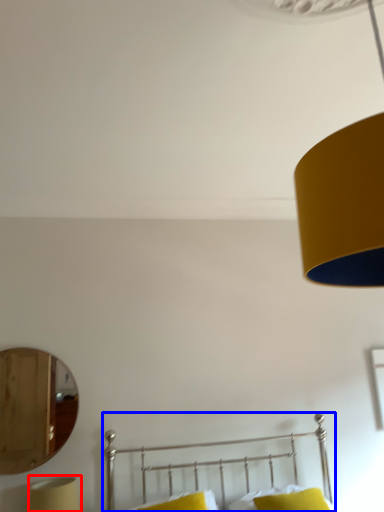
Question: Which point is closer to the camera, bedside lamp (highlighted by a red box) or bed (highlighted by a blue box)?

Choices:
 (A) bedside lamp
 (B) bed

Answer: (B)